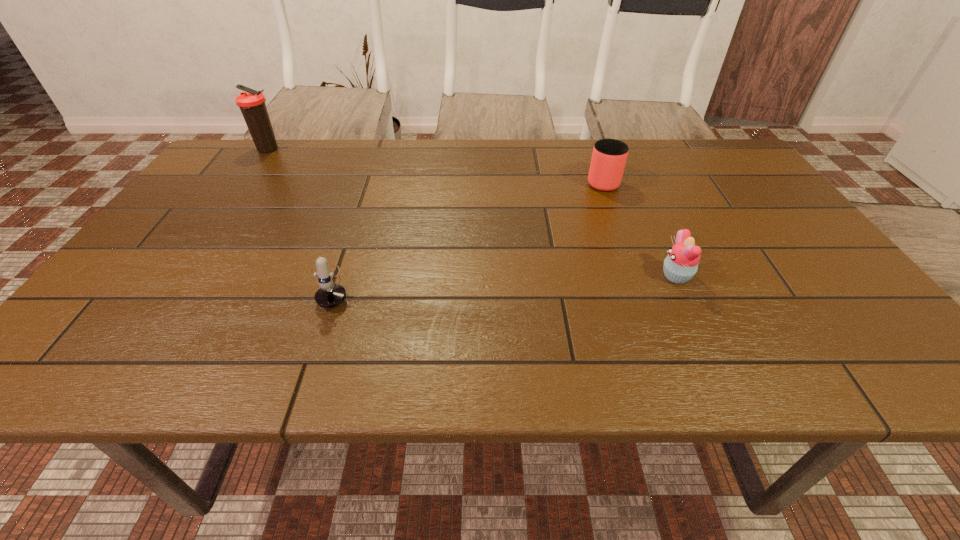
I want to click on vacant point located between the rightmost object and the tallest object, so click(472, 213).

Locate an element on the screen. The image size is (960, 540). vacant space that is in between the farthest object and the rightmost object is located at coordinates (472, 213).

Locate an element on the screen. Image resolution: width=960 pixels, height=540 pixels. free space between the third object from left to right and the microphone is located at coordinates (469, 234).

I want to click on the second closest object relative to the rightmost object, so click(x=329, y=295).

I want to click on object that is the third closest to the leftmost object, so click(681, 264).